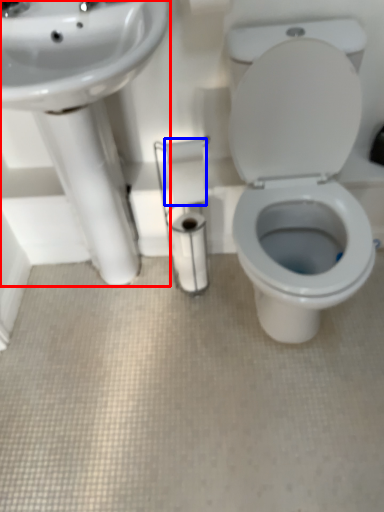
Question: Which object is further to the camera taking this photo, sink (highlighted by a red box) or toilet paper (highlighted by a blue box)?

Choices:
 (A) sink
 (B) toilet paper

Answer: (B)